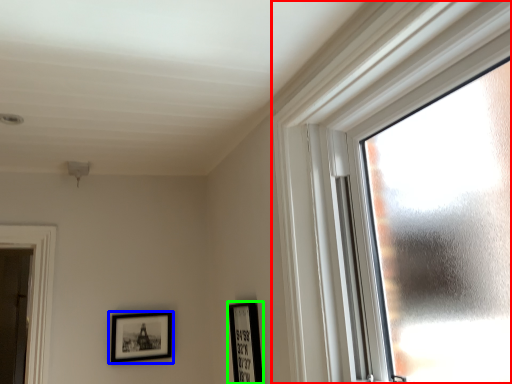
Question: Which is nearer to the window (highlighted by a red box)? picture frame (highlighted by a blue box) or picture frame (highlighted by a green box).

Choices:
 (A) picture frame
 (B) picture frame

Answer: (B)